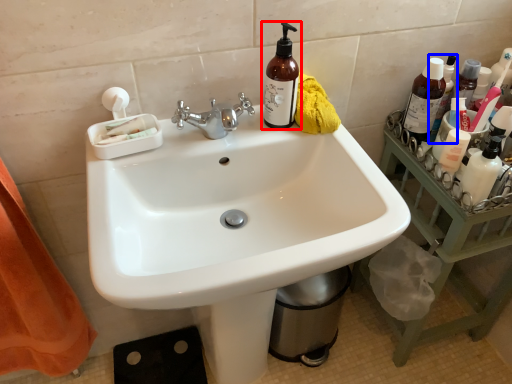
Question: Which object appears farthest to the camera in this image, bottle (highlighted by a red box) or bottle (highlighted by a blue box)?

Choices:
 (A) bottle
 (B) bottle

Answer: (B)